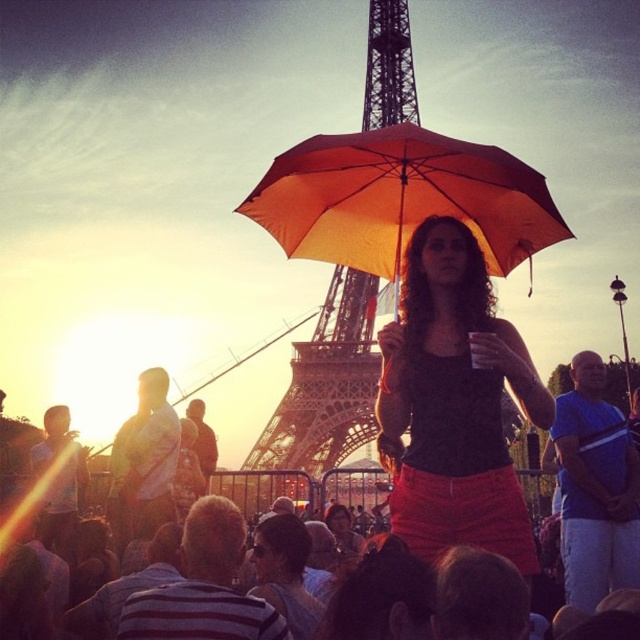
Question: Does metallic structure at center appear on the left side of matte black umbrella at center?

Choices:
 (A) yes
 (B) no

Answer: (B)

Question: Estimate the real-world distances between objects in this image. Which object is farther from the orange matte umbrella at center?

Choices:
 (A) matte black tank top at center
 (B) matte black umbrella at center

Answer: (B)

Question: Is metallic structure at center closer to camera compared to translucent glass beverage at center?

Choices:
 (A) no
 (B) yes

Answer: (B)

Question: Among these objects, which one is farthest from the camera?

Choices:
 (A) metallic structure at center
 (B) translucent glass beverage at center
 (C) orange matte umbrella at center
 (D) matte black umbrella at center

Answer: (B)

Question: Is matte black tank top at center bigger than metallic structure at center?

Choices:
 (A) no
 (B) yes

Answer: (A)

Question: Among these objects, which one is farthest from the camera?

Choices:
 (A) orange matte umbrella at center
 (B) matte black umbrella at center
 (C) matte black tank top at center

Answer: (A)